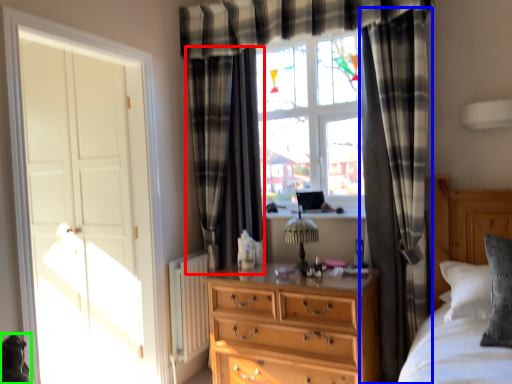
Question: Considering the real-world distances, which object is farthest from curtain (highlighted by a red box)? curtain (highlighted by a blue box) or animal (highlighted by a green box)?

Choices:
 (A) curtain
 (B) animal

Answer: (B)